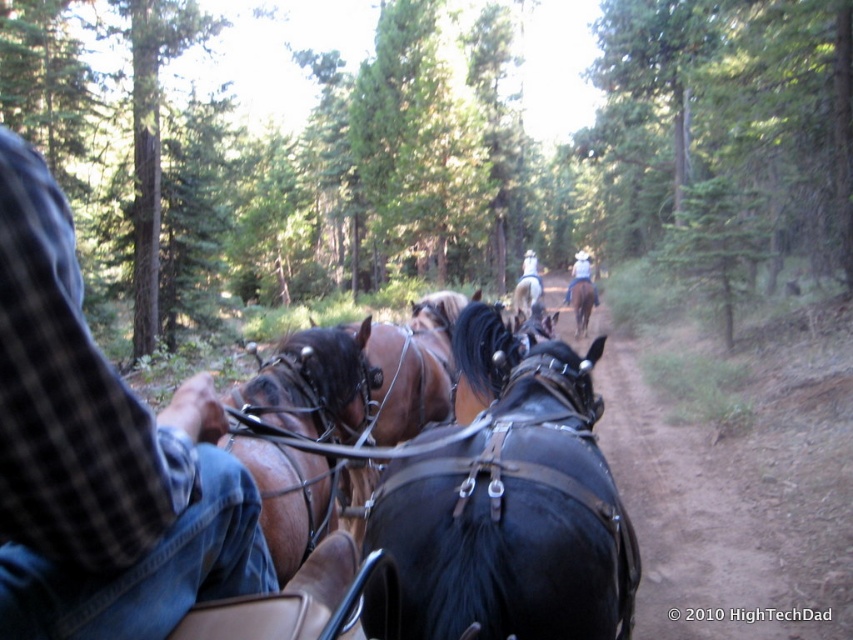
Question: Which object is positioned farthest from the brown leather horse at center?

Choices:
 (A) brown leather coach at center
 (B) black leather horse at center

Answer: (A)

Question: Among these objects, which one is farthest from the camera?

Choices:
 (A) green leafy pine trees at center
 (B) black leather horse at center

Answer: (A)

Question: Estimate the real-world distances between objects in this image. Which object is farther from the brown glossy horse at center?

Choices:
 (A) brown leather coach at center
 (B) white cowboy hat at upper center
 (C) green leafy pine trees at center

Answer: (C)

Question: Is brown glossy horse at center below shiny brown horse at center?

Choices:
 (A) yes
 (B) no

Answer: (A)

Question: Can you confirm if brown leather coach at center is smaller than brown leather horse at center?

Choices:
 (A) no
 (B) yes

Answer: (B)

Question: Is brown leather coach at center to the left of black leather horse at center from the viewer's perspective?

Choices:
 (A) yes
 (B) no

Answer: (A)